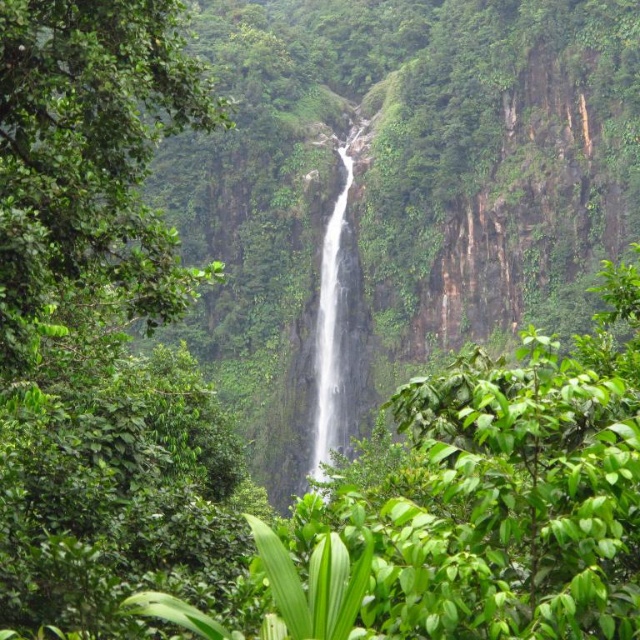
Question: Which point appears closest to the camera in this image?

Choices:
 (A) (163, 72)
 (B) (330, 220)

Answer: (A)

Question: Does green leafy tree at center appear under white smooth waterfall at center?

Choices:
 (A) no
 (B) yes

Answer: (A)

Question: Is green leafy tree at center closer to the viewer compared to white smooth waterfall at center?

Choices:
 (A) no
 (B) yes

Answer: (B)

Question: Is green leafy tree at center closer to camera compared to white smooth waterfall at center?

Choices:
 (A) yes
 (B) no

Answer: (A)

Question: Which of the following is the closest to the observer?

Choices:
 (A) (54, 60)
 (B) (339, 262)

Answer: (A)